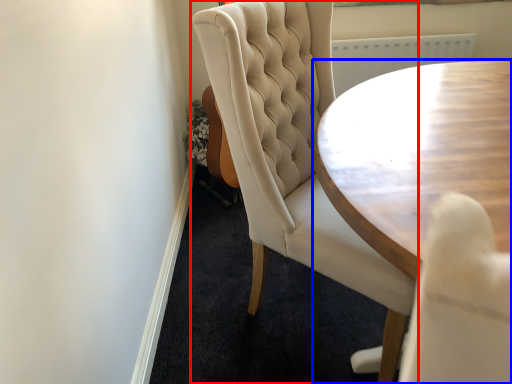
Question: Which point is further to the camera, chair (highlighted by a red box) or coffee table (highlighted by a blue box)?

Choices:
 (A) chair
 (B) coffee table

Answer: (A)